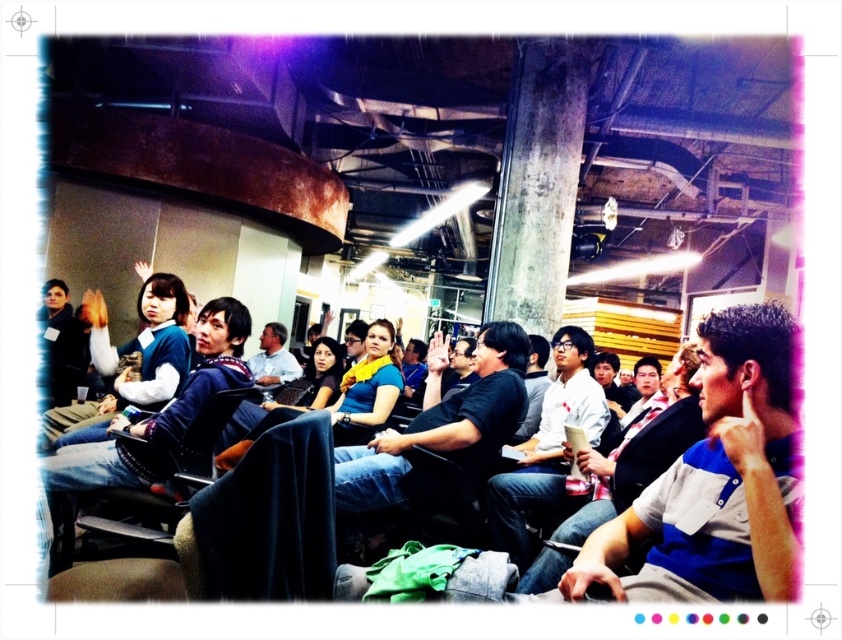
The image size is (842, 640). Describe the element at coordinates (440, 429) in the screenshot. I see `black matte shirt at center` at that location.

Can you confirm if black matte shirt at center is positioned to the left of knitted sweater at center?

In fact, black matte shirt at center is to the right of knitted sweater at center.

Does point (354, 484) come in front of point (222, 372)?

Yes.

The height and width of the screenshot is (640, 842). Find the location of `black matte shirt at center`. black matte shirt at center is located at coordinates (440, 429).

Can you confirm if black matte shirt at center is positioned to the left of white matte shirt at center?

Correct, you'll find black matte shirt at center to the left of white matte shirt at center.

Can you confirm if black matte shirt at center is positioned below white matte shirt at center?

Incorrect, black matte shirt at center is not positioned below white matte shirt at center.

This screenshot has width=842, height=640. Describe the element at coordinates (440, 429) in the screenshot. I see `black matte shirt at center` at that location.

Where is `black matte shirt at center`? This screenshot has height=640, width=842. black matte shirt at center is located at coordinates (440, 429).

Is the position of concrete at center less distant than that of knitted sweater at center?

No, it is behind knitted sweater at center.

Where is `concrete at center`? This screenshot has height=640, width=842. concrete at center is located at coordinates (537, 182).

The height and width of the screenshot is (640, 842). I want to click on concrete at center, so click(537, 182).